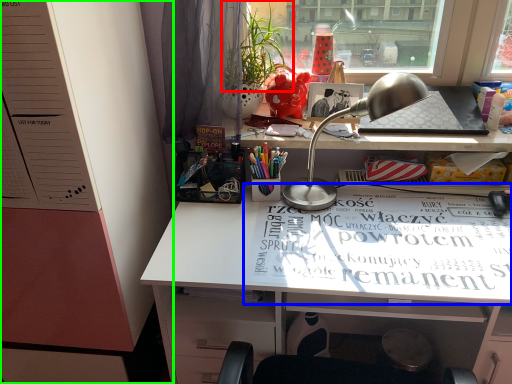
Question: Which is nearer to the plant (highlighted by a red box)? magazine (highlighted by a blue box) or dresser (highlighted by a green box).

Choices:
 (A) magazine
 (B) dresser

Answer: (B)